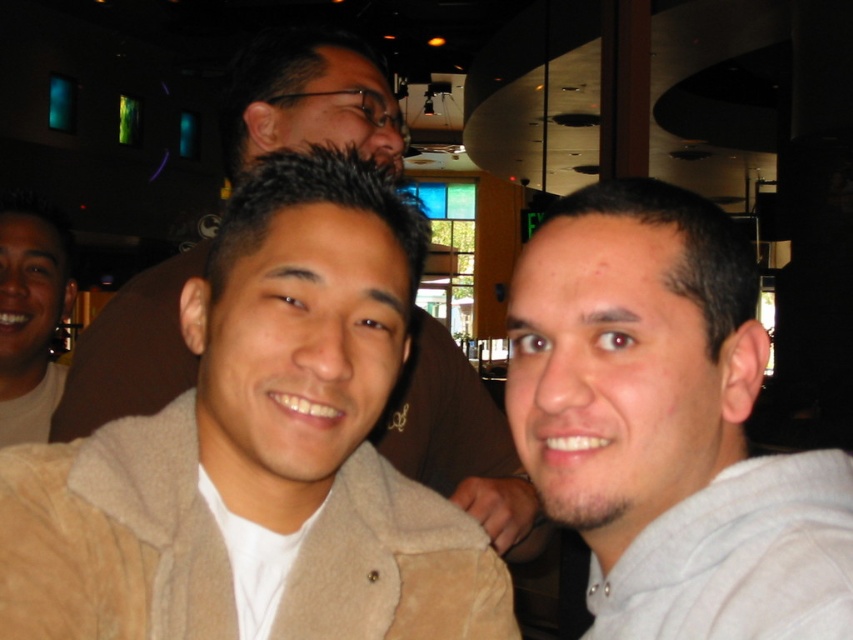
Who is more forward, (320,106) or (25,266)?

Positioned in front is point (320,106).

Does beige suede jacket at center have a greater width compared to light brown t-shirt at left?

Indeed, beige suede jacket at center has a greater width compared to light brown t-shirt at left.

Where is `beige suede jacket at center`? The image size is (853, 640). beige suede jacket at center is located at coordinates (459, 442).

Is gray hoodie at right wider than light brown t-shirt at left?

Yes.

Between point (683, 349) and point (15, 307), which one is positioned behind?

The point (15, 307) is behind.

What are the coordinates of `gray hoodie at right` in the screenshot? It's located at (666, 424).

Between point (590, 378) and point (426, 324), which one is positioned in front?

Point (590, 378)

Is gray hoodie at right closer to camera compared to beige suede jacket at center?

Yes, gray hoodie at right is closer to the viewer.

Image resolution: width=853 pixels, height=640 pixels. Describe the element at coordinates (666, 424) in the screenshot. I see `gray hoodie at right` at that location.

Identify the location of gray hoodie at right. This screenshot has height=640, width=853. (666, 424).